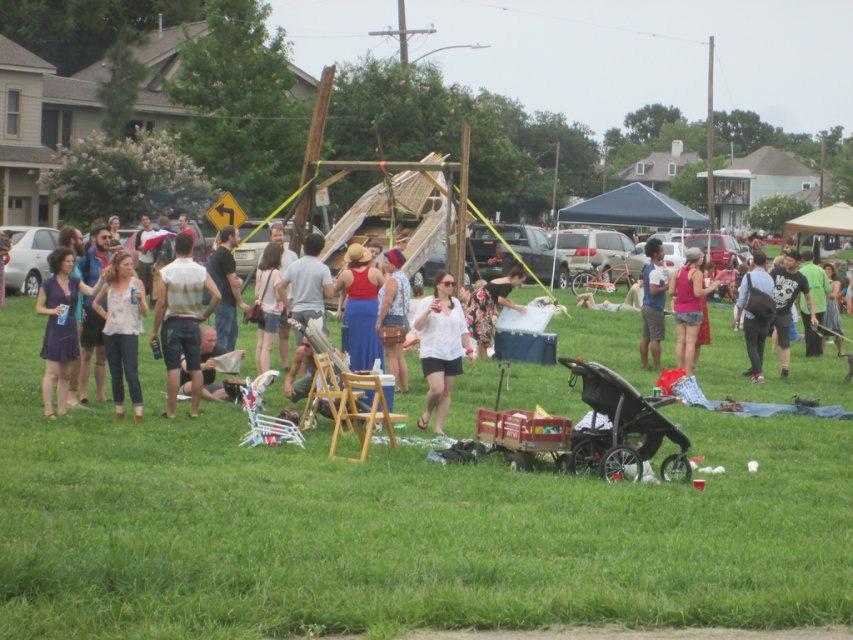
Who is positioned more to the right, pink fabric dress at center or dark gray backpack at center-right?

From the viewer's perspective, dark gray backpack at center-right appears more on the right side.

Does pink fabric dress at center appear under dark gray backpack at center-right?

Indeed, pink fabric dress at center is positioned under dark gray backpack at center-right.

At what (x,y) coordinates should I click in order to perform the action: click on pink fabric dress at center. Please return your answer as a coordinate pair (x, y). Image resolution: width=853 pixels, height=640 pixels. Looking at the image, I should click on (688, 305).

Between point (683, 468) and point (128, 317), which one is positioned in front?

Positioned in front is point (683, 468).

Between point (608, 397) and point (134, 356), which one is positioned behind?

Positioned behind is point (134, 356).

Is point (640, 396) behind point (134, 380)?

No, it is not.

This screenshot has width=853, height=640. What are the coordinates of `black plastic baby carriage at center` in the screenshot? It's located at (619, 428).

Identify the location of matte white blouse at center. (122, 328).

Locate an element on the screen. This screenshot has width=853, height=640. matte white blouse at center is located at coordinates (122, 328).

This screenshot has height=640, width=853. I want to click on matte white blouse at center, so click(x=122, y=328).